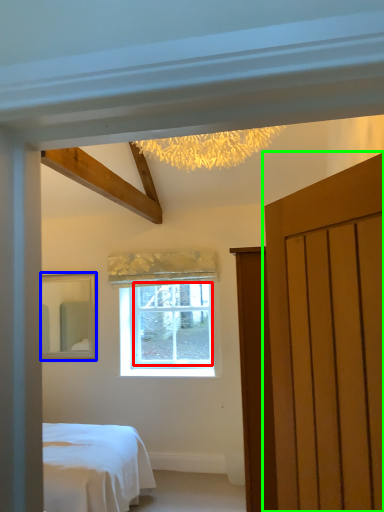
Question: Considering the real-world distances, which object is closest to window screen (highlighted by a red box)? mirror (highlighted by a blue box) or door (highlighted by a green box).

Choices:
 (A) mirror
 (B) door

Answer: (A)